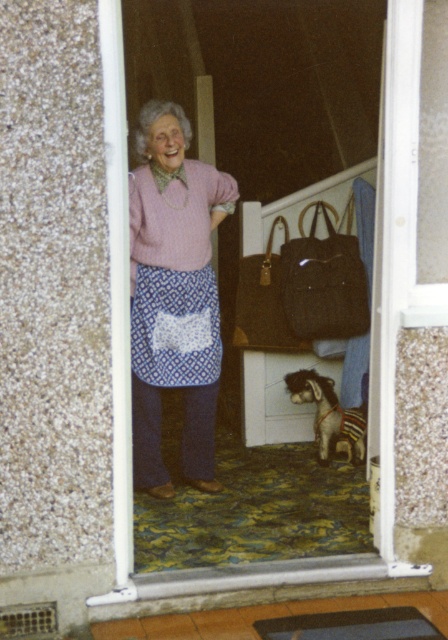
You are a delivery person holding a package that requires a space of 30 cm in width to place. You see the pink knitted sweater at center and the brown woven bag at center. Can you place the package between them?

The pink knitted sweater at center might be wider than brown woven bag at center. If the sweater is indeed wider, there might be enough space between them to place the package. However, since the exact width difference isn t specified, it s uncertain whether the 30 cm requirement is met.

You are a fashion designer observing a woman standing in a doorway. She is wearing a pink knitted sweater at center and has a brown woven bag at center. Which item is taller?

The pink knitted sweater at center is taller than the brown woven bag at center.

You are a fashion designer analyzing the image of a woman standing in her doorway. You need to note the exact 2D coordinates of the pink knitted sweater at center for your design reference. What are the coordinates?

The pink knitted sweater at center is located at the 2D coordinates of point (173, 296).